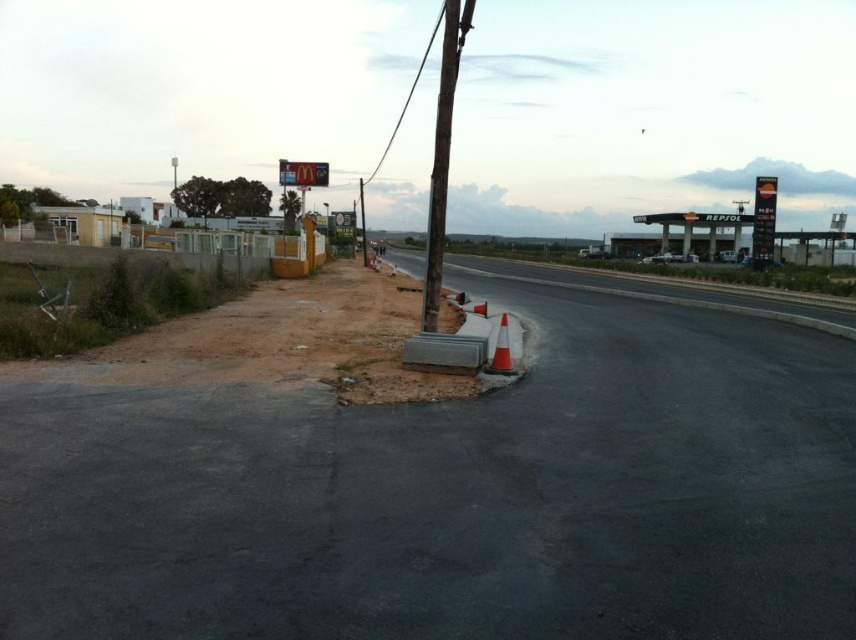
Question: Considering the real-world distances, which object is closest to the orange reflective cone at lower right?

Choices:
 (A) brown wooden pole at center
 (B) smooth concrete pole at center
 (C) black asphalt highway at center

Answer: (A)

Question: Estimate the real-world distances between objects in this image. Which object is farther from the white plastic mcdonald's sign at upper center?

Choices:
 (A) brown wooden pole at center
 (B) orange reflective cone at lower right
 (C) smooth concrete pole at center
 (D) black asphalt highway at center

Answer: (B)

Question: Can you confirm if white plastic mcdonald's sign at upper center is smaller than smooth concrete pole at center?

Choices:
 (A) no
 (B) yes

Answer: (A)

Question: Considering the relative positions of black asphalt highway at center and orange reflective cone at lower right in the image provided, where is black asphalt highway at center located with respect to orange reflective cone at lower right?

Choices:
 (A) right
 (B) left

Answer: (A)

Question: Estimate the real-world distances between objects in this image. Which object is farther from the brown wooden pole at center?

Choices:
 (A) white plastic mcdonald's sign at upper center
 (B) smooth concrete pole at center

Answer: (B)

Question: In this image, where is white plastic mcdonald's sign at upper center located relative to smooth concrete pole at center?

Choices:
 (A) below
 (B) above

Answer: (B)